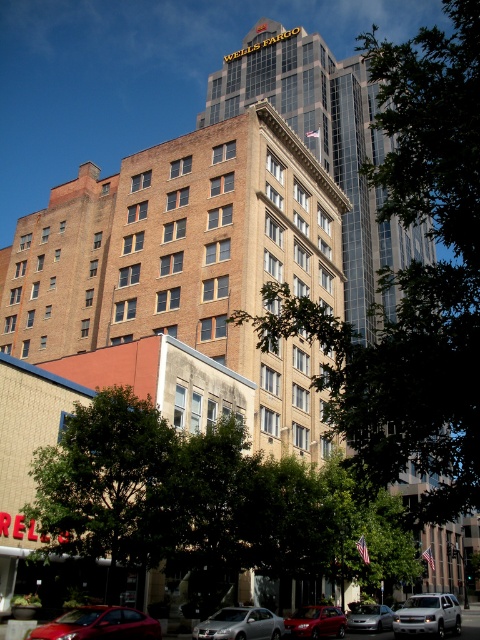
Question: Can you confirm if shiny red sedan at lower left is positioned below satin silver sedan at lower center?

Choices:
 (A) no
 (B) yes

Answer: (A)

Question: Can you confirm if white matte suv at lower right is smaller than shiny red sedan at lower center?

Choices:
 (A) yes
 (B) no

Answer: (B)

Question: Which point appears farthest from the camera in this image?

Choices:
 (A) (132, 632)
 (B) (432, 609)
 (C) (311, 627)
 (D) (372, 624)

Answer: (D)

Question: Based on their relative distances, which object is nearer to the satin silver sedan at lower center?

Choices:
 (A) silver metallic sedan at center
 (B) shiny red sedan at lower left
 (C) white matte suv at lower right

Answer: (C)

Question: Which point is closer to the camera?

Choices:
 (A) (277, 618)
 (B) (57, 618)
 (C) (453, 605)

Answer: (B)

Question: Is shiny red sedan at lower left above satin silver sedan at lower center?

Choices:
 (A) no
 (B) yes

Answer: (B)